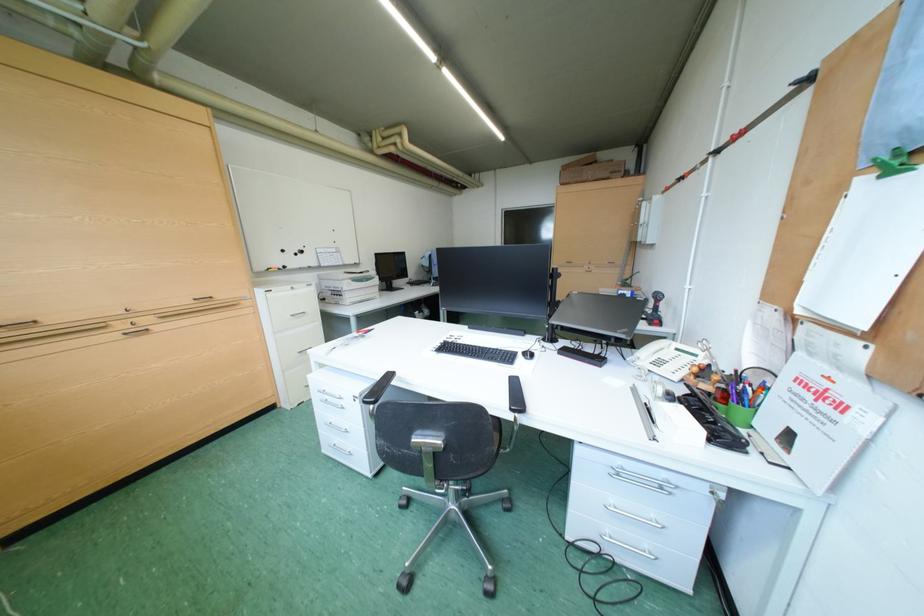
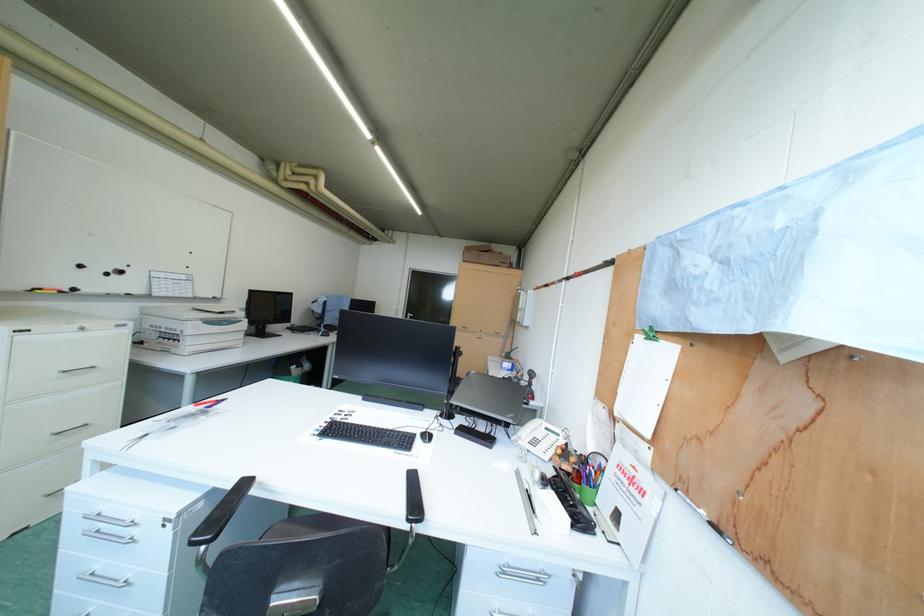
Question: The images are taken continuously from a first-person perspective. In which direction is your viewpoint rotating?

Choices:
 (A) Left
 (B) Right
 (C) Up
 (D) Down

Answer: (B)